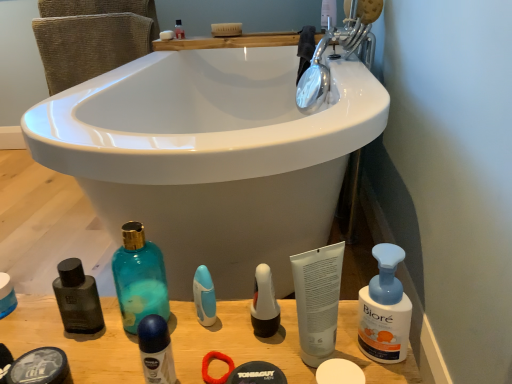
The height and width of the screenshot is (384, 512). In order to click on vacant space positioned to the left of blue matte deodorant at center, acting as the fifth toiletry starting from the back in this screenshot , I will do `click(82, 347)`.